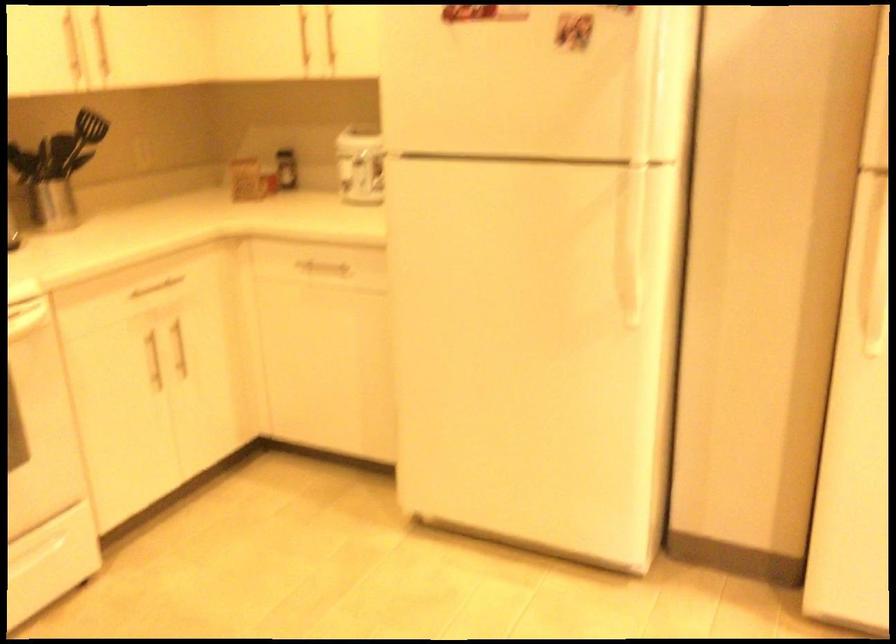
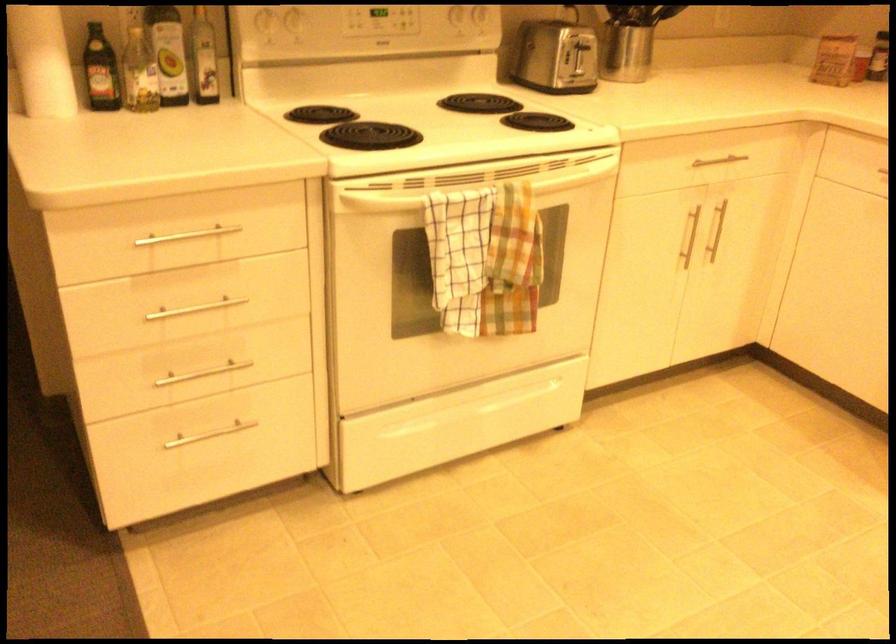
The point at (154, 359) is marked in the first image. Where is the corresponding point in the second image?

(687, 237)